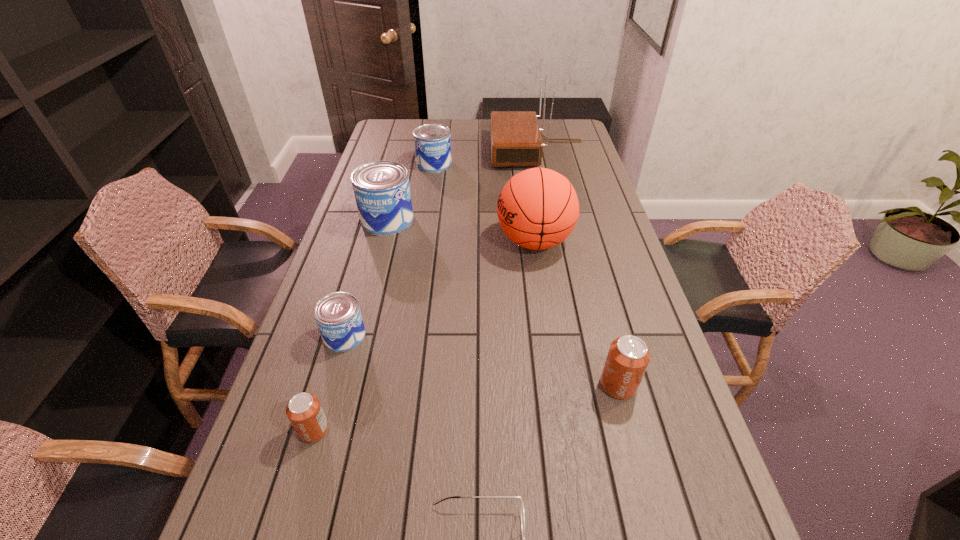
Identify the location of radio_receiver. The width and height of the screenshot is (960, 540). (516, 140).

I want to click on basketball, so click(x=538, y=208).

Image resolution: width=960 pixels, height=540 pixels. I want to click on the tallest can, so click(x=382, y=192).

Where is `the second farthest can`? This screenshot has width=960, height=540. the second farthest can is located at coordinates (x=382, y=192).

The image size is (960, 540). I want to click on the rightmost can, so click(x=628, y=357).

The width and height of the screenshot is (960, 540). Find the location of `the right orange can`. the right orange can is located at coordinates (628, 357).

Image resolution: width=960 pixels, height=540 pixels. What are the coordinates of `the second smallest blue can` in the screenshot? It's located at (432, 142).

The image size is (960, 540). I want to click on the farthest blue can, so click(432, 142).

The width and height of the screenshot is (960, 540). I want to click on the smaller orange can, so click(x=304, y=411).

The width and height of the screenshot is (960, 540). What are the coordinates of `the nearest can` in the screenshot? It's located at (304, 411).